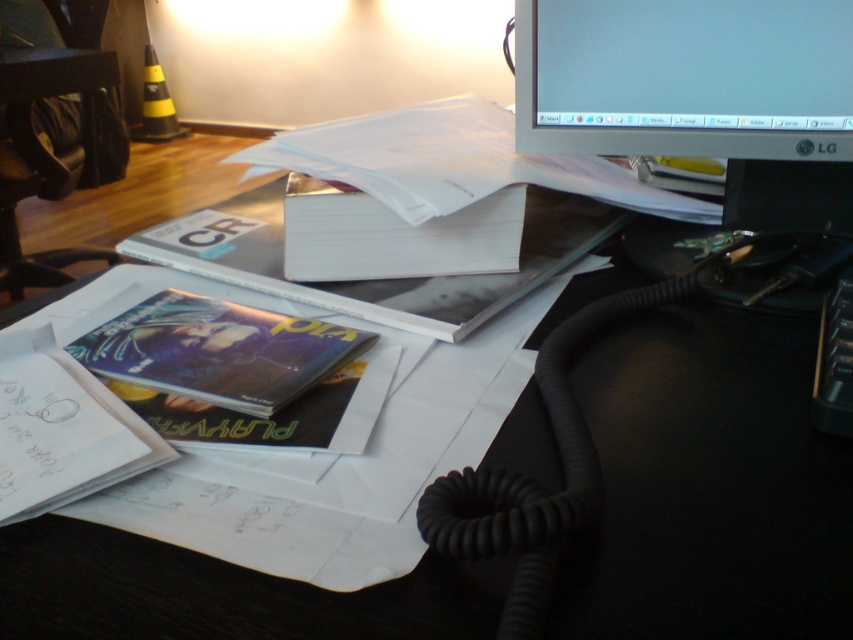
Does point (689, 465) lie in front of point (68, 420)?

Yes, point (689, 465) is closer to viewer.

Is point (219, 618) more distant than point (77, 486)?

No.

At what (x,y) coordinates should I click in order to perform the action: click on matte black monitor at upper center. Please return your answer as a coordinate pair (x, y). The image size is (853, 640). Looking at the image, I should click on coord(708,483).

Who is higher up, matte black monitor at upper center or matte black monitor at upper right?

matte black monitor at upper right is higher up.

How far apart are matte black monitor at upper center and matte black monitor at upper right?

The distance of matte black monitor at upper center from matte black monitor at upper right is 7.54 inches.

Describe the element at coordinates (708, 483) in the screenshot. I see `matte black monitor at upper center` at that location.

The image size is (853, 640). Identify the location of matte black monitor at upper center. (708, 483).

Where is `matte black monitor at upper right`? The image size is (853, 640). matte black monitor at upper right is located at coordinates click(x=699, y=93).

Does matte black monitor at upper right come behind matte plastic book at lower left?

Yes, matte black monitor at upper right is behind matte plastic book at lower left.

This screenshot has height=640, width=853. What do you see at coordinates (699, 93) in the screenshot?
I see `matte black monitor at upper right` at bounding box center [699, 93].

Locate an element on the screen. The image size is (853, 640). matte black monitor at upper right is located at coordinates click(x=699, y=93).